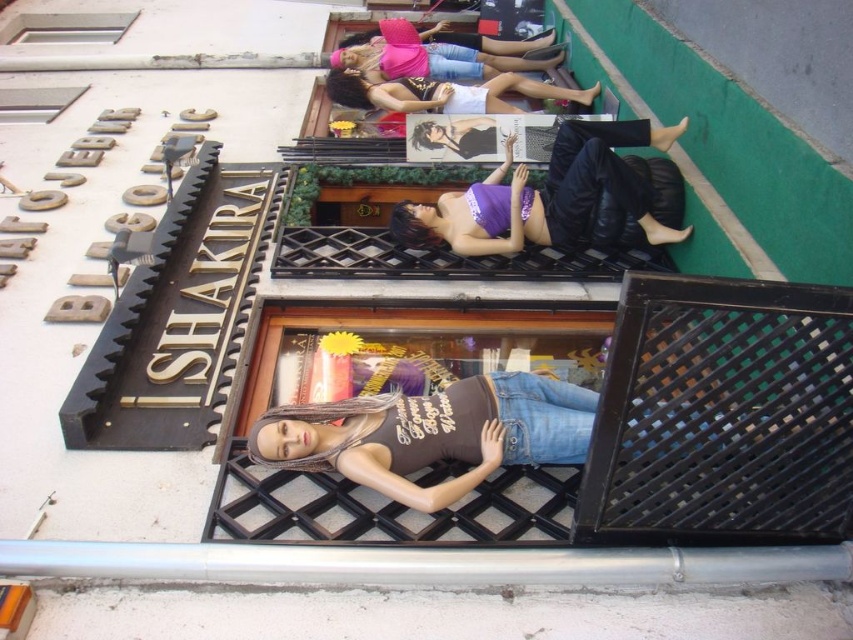
Between point (424, 230) and point (445, 54), which one is positioned in front?

Positioned in front is point (424, 230).

Who is more forward, (448, 230) or (386, 20)?

Point (448, 230) is more forward.

The width and height of the screenshot is (853, 640). Find the location of `purple satin top at center`. purple satin top at center is located at coordinates (547, 195).

Consider the image. Can you confirm if purple satin top at center is bigger than matte white tank top at upper center?

Actually, purple satin top at center might be smaller than matte white tank top at upper center.

Between purple satin top at center and matte white tank top at upper center, which one appears on the right side from the viewer's perspective?

purple satin top at center is more to the right.

Between point (582, 195) and point (334, 76), which one is positioned behind?

The point (334, 76) is behind.

Locate an element on the screen. This screenshot has height=640, width=853. purple satin top at center is located at coordinates (547, 195).

Does pink matte tank top at upper center appear on the left side of matte white tank top at upper center?

Yes, pink matte tank top at upper center is to the left of matte white tank top at upper center.

Locate an element on the screen. pink matte tank top at upper center is located at coordinates (436, 52).